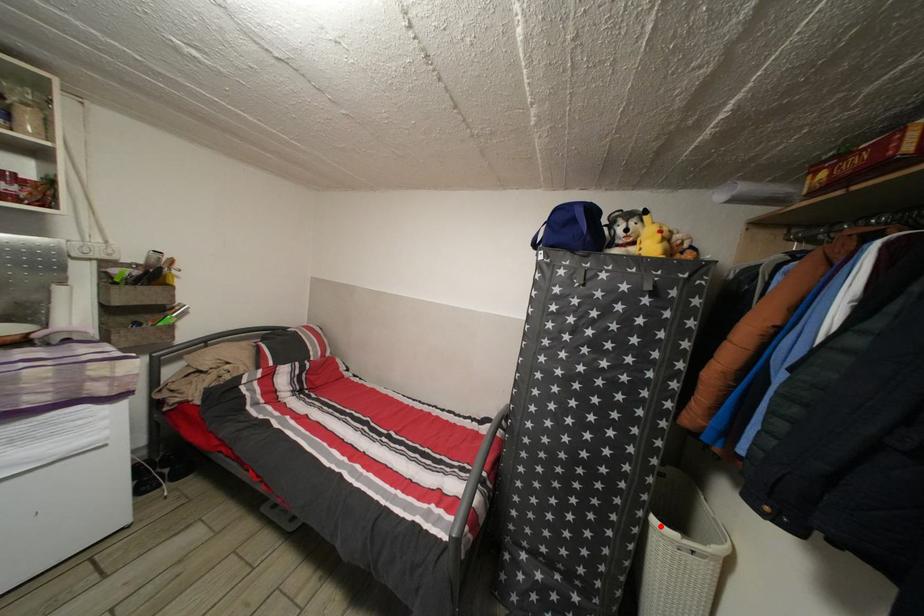
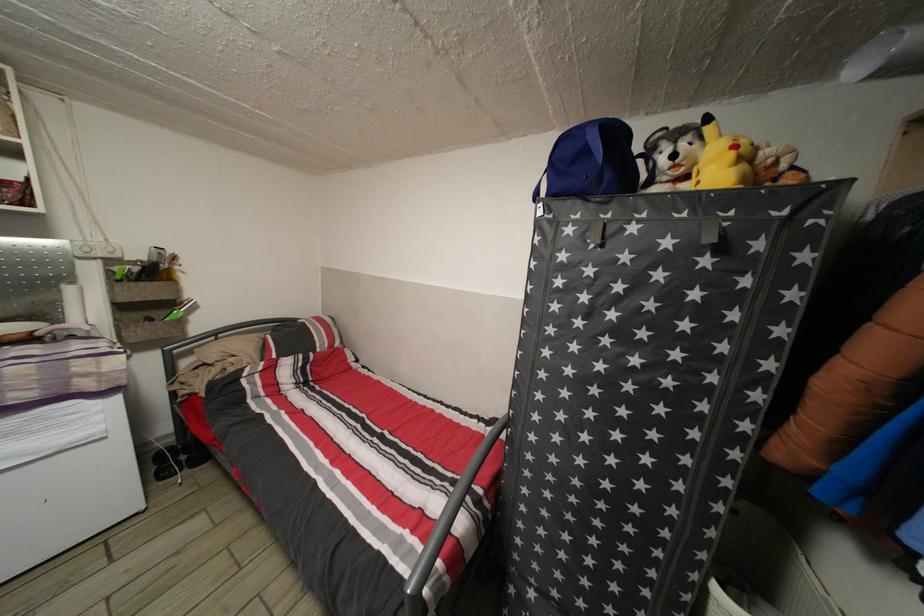
In the second image, find the point that corresponds to the highlighted location in the first image.

(723, 594)